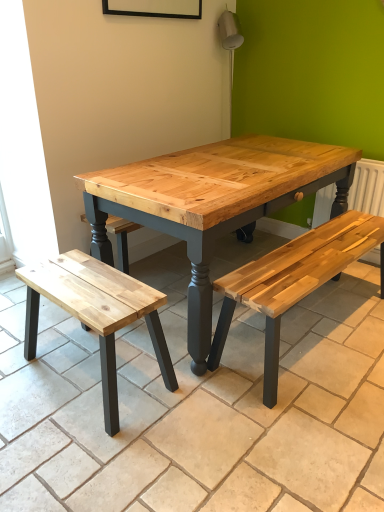
Question: Is natural wood bench at lower left to the right of white painted radiator at right from the viewer's perspective?

Choices:
 (A) yes
 (B) no

Answer: (B)

Question: Is natural wood bench at lower left facing towards white painted radiator at right?

Choices:
 (A) no
 (B) yes

Answer: (A)

Question: Is natural wood bench at lower left positioned far away from white painted radiator at right?

Choices:
 (A) no
 (B) yes

Answer: (B)

Question: Is the position of natural wood bench at lower left more distant than that of white painted radiator at right?

Choices:
 (A) no
 (B) yes

Answer: (A)

Question: Is natural wood bench at lower left in front of white painted radiator at right?

Choices:
 (A) no
 (B) yes

Answer: (B)

Question: Is natural wood bench at lower left next to white painted radiator at right and touching it?

Choices:
 (A) yes
 (B) no

Answer: (B)

Question: Is natural wood bench at lower left with natural wood bench at lower right?

Choices:
 (A) no
 (B) yes

Answer: (A)

Question: Is natural wood bench at lower left taller than natural wood bench at lower right?

Choices:
 (A) yes
 (B) no

Answer: (A)

Question: From the image's perspective, is natural wood bench at lower left on top of natural wood bench at lower right?

Choices:
 (A) no
 (B) yes

Answer: (B)

Question: From a real-world perspective, is natural wood bench at lower left below natural wood bench at lower right?

Choices:
 (A) yes
 (B) no

Answer: (B)

Question: Are natural wood bench at lower left and natural wood bench at lower right located far from each other?

Choices:
 (A) yes
 (B) no

Answer: (B)

Question: Is natural wood bench at lower left facing towards natural wood bench at lower right?

Choices:
 (A) no
 (B) yes

Answer: (A)

Question: Is white painted radiator at right bigger than natural wood bench at lower left?

Choices:
 (A) no
 (B) yes

Answer: (A)